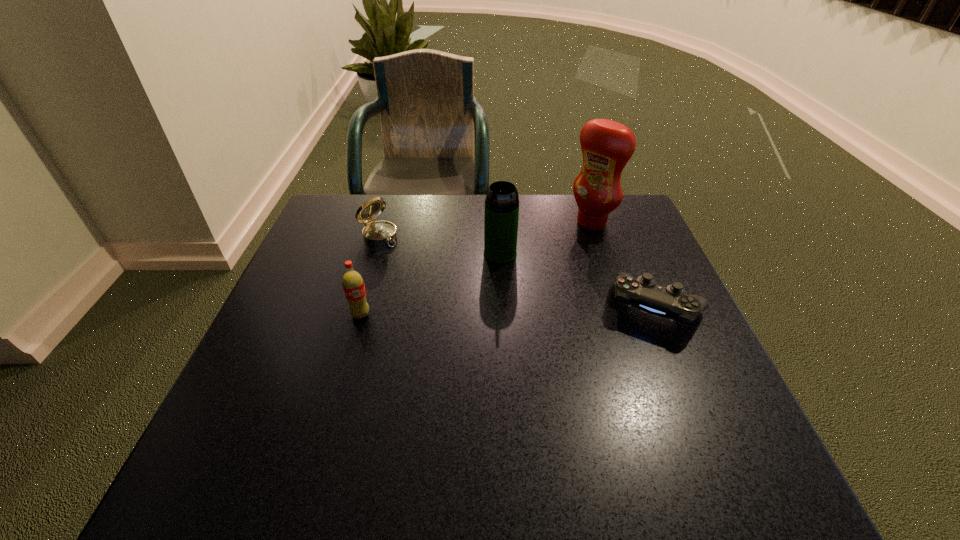
Locate an element on the screen. This screenshot has height=540, width=960. control that is at the right edge is located at coordinates (672, 302).

In order to click on condiment that is at the right edge in this screenshot , I will do `click(607, 146)`.

Find the location of a particular element. The height and width of the screenshot is (540, 960). object that is at the far left corner is located at coordinates (375, 233).

Locate an element on the screen. Image resolution: width=960 pixels, height=540 pixels. object that is at the far right corner is located at coordinates (607, 146).

You are a GUI agent. You are given a task and a screenshot of the screen. Output one action in this format:
    pyautogui.click(x=<x>, y=<y>)
    Task: Click on the free space at the far edge of the desktop
    Image resolution: width=960 pixels, height=540 pixels.
    Given the screenshot: What is the action you would take?
    pyautogui.click(x=403, y=206)

Where is `free spot at the near edge of the desktop`? This screenshot has width=960, height=540. free spot at the near edge of the desktop is located at coordinates (395, 406).

I want to click on free space at the left edge, so click(265, 342).

I want to click on vacant space at the right edge, so click(656, 263).

In the image, there is a desktop. Where is `vacant space at the far left corner`? vacant space at the far left corner is located at coordinates (355, 203).

This screenshot has width=960, height=540. Identify the location of free spot at the near left corner of the desktop. (254, 392).